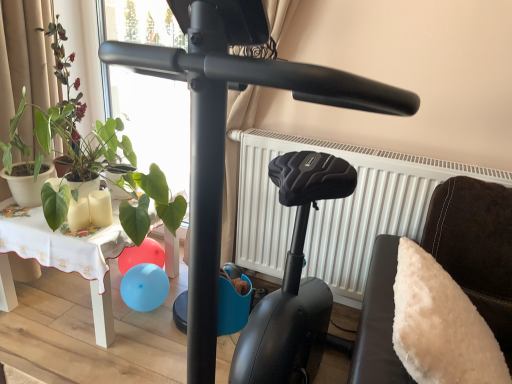
Question: From a real-world perspective, is green matte plant at left above or below white fabric-covered table at lower left?

Choices:
 (A) above
 (B) below

Answer: (A)

Question: Is green matte plant at left taller or shorter than white fabric-covered table at lower left?

Choices:
 (A) short
 (B) tall

Answer: (A)

Question: Estimate the real-world distances between objects in this image. Which object is farther from the green matte plant at left, which is the first plant in top-to-bottom order?

Choices:
 (A) green matte plant at left
 (B) black matte stationary bicycle at center
 (C) white fabric-covered table at lower left
 (D) white fluffy pillow at right
 (E) white matte radiator at center

Answer: (D)

Question: Considering the real-world distances, which object is farthest from the white fluffy pillow at right?

Choices:
 (A) green matte plant at left
 (B) green matte plant at left, the second plant when ordered from bottom to top
 (C) white fabric-covered table at lower left
 (D) white matte radiator at center
 (E) black matte stationary bicycle at center

Answer: (A)